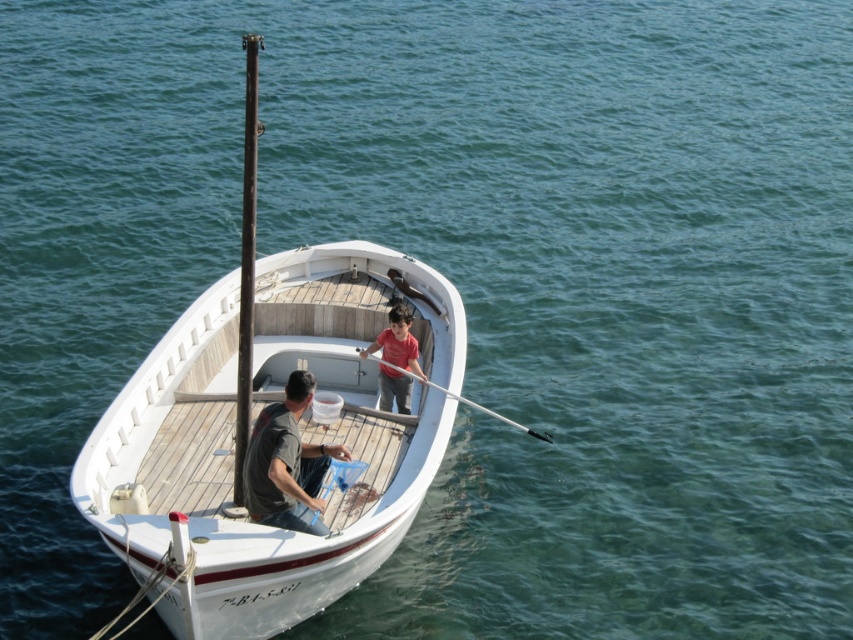
You are navigating a narrow waterway and need to pass through a gap between the white wooden boat at center and the dark brown wooden pole at center. Which direction should you steer your boat to avoid collision?

The white wooden boat at center is to the right of the dark brown wooden pole at center, so you should steer your boat to the left to avoid collision.

You are navigating a small white rowboat on turquoise waters. You notice two points marked on the boat deck. The first point is at coordinate (245, 612) and the second at (524, 432). From your position at the stern, which point is closer to you?

Point (524, 432) is closer to you because it is behind point (245, 612) from your perspective at the stern.

You are a person who is 1.8 meters tall and wants to lie down in the white wooden boat at center. Is there enough space for you to lie down comfortably without touching the smooth white pole at center?

The white wooden boat at center and smooth white pole at center are 2.56 meters apart. Since you are 1.8 meters tall, there is sufficient space to lie down comfortably without touching the smooth white pole at center.